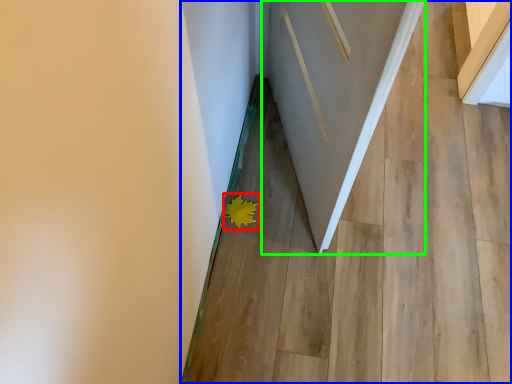
Question: Estimate the real-world distances between objects in this image. Which object is farther from flower (highlighted by a red box), stairwell (highlighted by a blue box) or door (highlighted by a green box)?

Choices:
 (A) stairwell
 (B) door

Answer: (B)